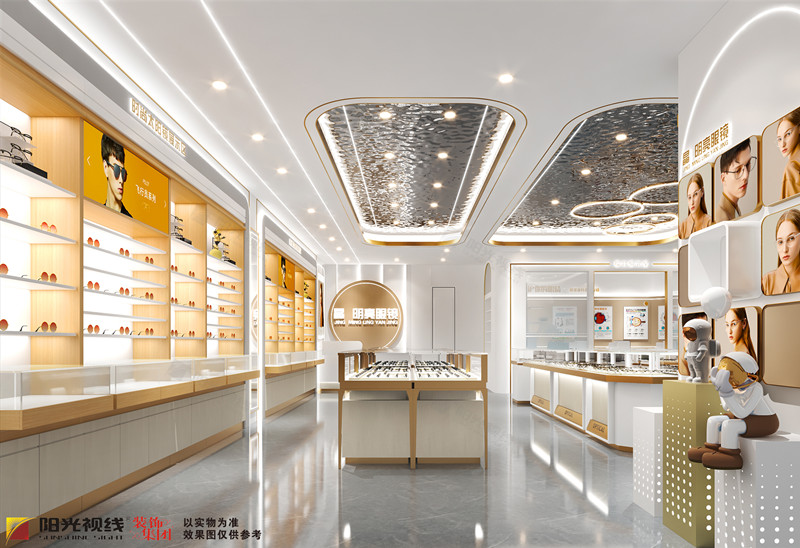
This screenshot has height=548, width=800. Find the location of `white ceiling area`. white ceiling area is located at coordinates (565, 62), (292, 49), (470, 246), (380, 258).